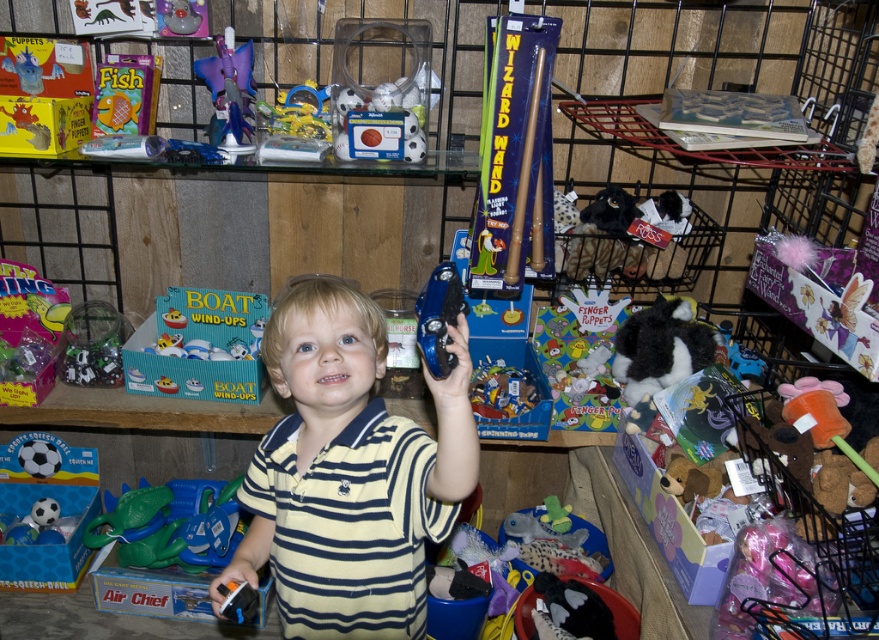
Can you confirm if yellow striped shirt at center is shorter than matte blue boat at center?

No, yellow striped shirt at center is not shorter than matte blue boat at center.

Where is `yellow striped shirt at center`? The width and height of the screenshot is (879, 640). yellow striped shirt at center is located at coordinates (349, 472).

Is point (384, 472) farther from viewer compared to point (140, 369)?

No.

This screenshot has width=879, height=640. Identify the location of yellow striped shirt at center. (349, 472).

How far apart are black plush toy at lower right and blue plastic tambourine at upper center?

They are 28.01 inches apart.

Who is positioned more to the right, black plush toy at lower right or blue plastic tambourine at upper center?

black plush toy at lower right is more to the right.

Describe the element at coordinates (660, 348) in the screenshot. I see `black plush toy at lower right` at that location.

This screenshot has height=640, width=879. I want to click on black plush toy at lower right, so click(660, 348).

Is point (292, 554) in front of point (469, 614)?

Yes, point (292, 554) is closer to viewer.

Can you confirm if yellow striped shirt at center is shorter than fuzzy fabric stuffed animal at lower right?

In fact, yellow striped shirt at center may be taller than fuzzy fabric stuffed animal at lower right.

Is point (346, 627) positioned after point (599, 545)?

That is False.

Where is `yellow striped shirt at center`? Image resolution: width=879 pixels, height=640 pixels. yellow striped shirt at center is located at coordinates (349, 472).